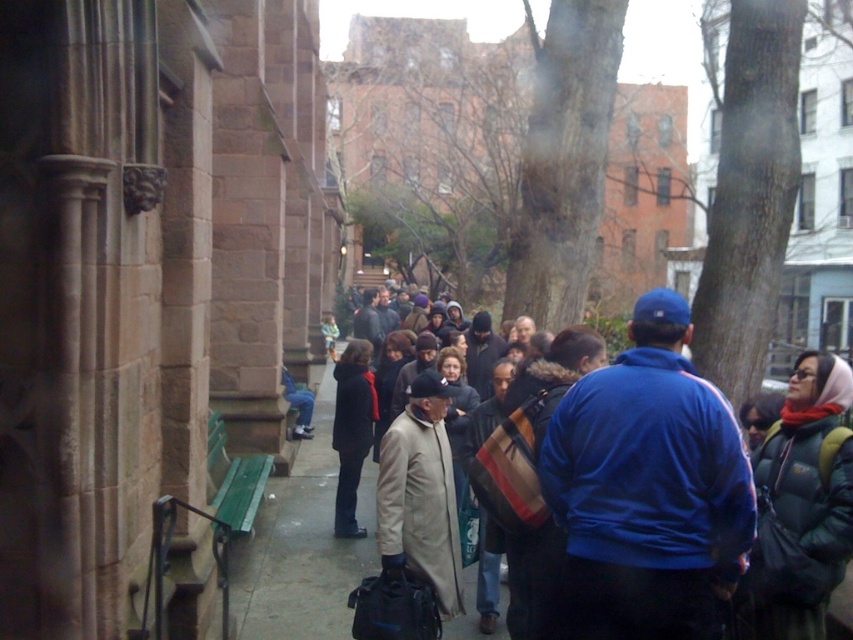
You are a delivery person trying to navigate through the narrow alleyway. You see a dark blue jacket at center and a light gray concrete sidewalk at center. Which object is higher in height?

The dark blue jacket at center is taller than the light gray concrete sidewalk at center.

You are standing at the entrance of the alley and want to walk to the light gray concrete sidewalk at center. According to the coordinates provided, in which direction should you move relative to your current position?

The light gray concrete sidewalk at center is located at coordinates point (305,547), so you should move forward and to the right relative to your current position at the entrance.